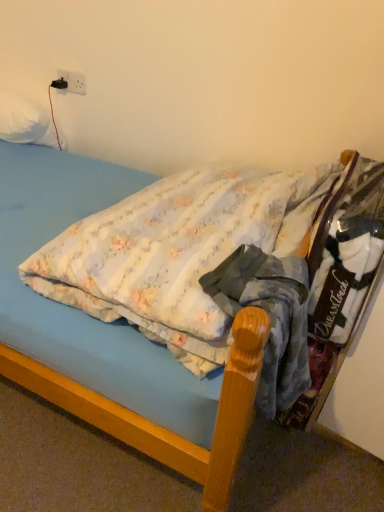
What do you see at coordinates (101, 330) in the screenshot?
I see `fluffy cotton bed at center` at bounding box center [101, 330].

You are a GUI agent. You are given a task and a screenshot of the screen. Output one action in this format:
    pyautogui.click(x=<x>, y=<y>)
    Task: Click on the blue cotton shirt at center
    The height and width of the screenshot is (512, 384).
    Given the screenshot: What is the action you would take?
    [x=270, y=317]

The height and width of the screenshot is (512, 384). I want to click on fluffy cotton bed at center, so [x=101, y=330].

In terms of size, does white soft pillow at upper left appear bigger or smaller than fluffy cotton bed at center?

Clearly, white soft pillow at upper left is smaller in size than fluffy cotton bed at center.

Does white soft pillow at upper left have a lesser height compared to fluffy cotton bed at center?

Indeed, white soft pillow at upper left has a lesser height compared to fluffy cotton bed at center.

Is fluffy cotton bed at center surrounded by white soft pillow at upper left?

No, fluffy cotton bed at center is located outside of white soft pillow at upper left.

Considering the sizes of white soft pillow at upper left and fluffy cotton bed at center in the image, is white soft pillow at upper left wider or thinner than fluffy cotton bed at center?

In the image, white soft pillow at upper left appears to be more narrow than fluffy cotton bed at center.

Which of these two, fluffy cotton bed at center or blue cotton shirt at center, is thinner?

Thinner between the two is blue cotton shirt at center.

Considering the relative positions of fluffy cotton bed at center and blue cotton shirt at center in the image provided, is fluffy cotton bed at center behind blue cotton shirt at center?

No, fluffy cotton bed at center is closer to the viewer.

Looking at this image, who is smaller, fluffy cotton bed at center or blue cotton shirt at center?

blue cotton shirt at center.

Can you see white plastic electric outlet at upper left touching fluffy cotton bed at center?

There is a gap between white plastic electric outlet at upper left and fluffy cotton bed at center.

From the image's perspective, is white plastic electric outlet at upper left positioned above or below fluffy cotton bed at center?

Based on their image positions, white plastic electric outlet at upper left is located above fluffy cotton bed at center.

Does point (84, 77) come in front of point (42, 176)?

No, it is behind (42, 176).

Could fluffy cotton bed at center be considered to be inside white plastic electric outlet at upper left?

No, white plastic electric outlet at upper left does not contain fluffy cotton bed at center.

Which of these two, fluffy cotton bed at center or white soft pillow at upper left, is thinner?

white soft pillow at upper left.

Does point (239, 432) come farther from viewer compared to point (9, 126)?

No.

From the image's perspective, who appears lower, fluffy cotton bed at center or white soft pillow at upper left?

fluffy cotton bed at center, from the image's perspective.

From the image's perspective, which one is positioned higher, white plastic electric outlet at upper left or blue cotton shirt at center?

white plastic electric outlet at upper left.

Which object is further away from the camera taking this photo, white plastic electric outlet at upper left or blue cotton shirt at center?

white plastic electric outlet at upper left.

Can you confirm if white plastic electric outlet at upper left is smaller than blue cotton shirt at center?

Yes, white plastic electric outlet at upper left is smaller than blue cotton shirt at center.

Is point (85, 90) behind point (296, 261)?

Yes, it is.

Is white soft pillow at upper left smaller than blue cotton shirt at center?

Actually, white soft pillow at upper left might be larger than blue cotton shirt at center.

Can you tell me how much white soft pillow at upper left and blue cotton shirt at center differ in facing direction?

The angular difference between white soft pillow at upper left and blue cotton shirt at center is 80.8 degrees.

Considering the relative sizes of white soft pillow at upper left and blue cotton shirt at center in the image provided, is white soft pillow at upper left wider than blue cotton shirt at center?

No.

From a real-world perspective, is white plastic electric outlet at upper left positioned above or below white soft pillow at upper left?

white plastic electric outlet at upper left is situated higher than white soft pillow at upper left in the real world.

Is point (74, 91) positioned before point (32, 133)?

No, it is behind (32, 133).

Is white plastic electric outlet at upper left turned away from white soft pillow at upper left?

No, white plastic electric outlet at upper left is not facing the opposite direction of white soft pillow at upper left.

Between white plastic electric outlet at upper left and white soft pillow at upper left, which one has more height?

white soft pillow at upper left is taller.

Identify the location of bed that is under the white soft pillow at upper left (from a real-world perspective). (101, 330).

Image resolution: width=384 pixels, height=512 pixels. I want to click on bed that appears on the left of blue cotton shirt at center, so click(101, 330).

From the image, which object appears to be nearer to white plastic electric outlet at upper left, fluffy cotton bed at center or blue cotton shirt at center?

Among the two, fluffy cotton bed at center is located nearer to white plastic electric outlet at upper left.

Based on their spatial positions, is fluffy cotton bed at center or white soft pillow at upper left closer to blue cotton shirt at center?

Based on the image, fluffy cotton bed at center appears to be nearer to blue cotton shirt at center.

Looking at this image, estimate the real-world distances between objects in this image. Which object is further from white plastic electric outlet at upper left, white soft pillow at upper left or fluffy cotton bed at center?

Among the two, fluffy cotton bed at center is located further to white plastic electric outlet at upper left.

From the image, which object appears to be nearer to white plastic electric outlet at upper left, fluffy cotton bed at center or white soft pillow at upper left?

white soft pillow at upper left lies closer to white plastic electric outlet at upper left than the other object.

Considering their positions, is blue cotton shirt at center positioned further to white plastic electric outlet at upper left than white soft pillow at upper left?

Based on the image, blue cotton shirt at center appears to be further to white plastic electric outlet at upper left.

Estimate the real-world distances between objects in this image. Which object is closer to fluffy cotton bed at center, blue cotton shirt at center or white soft pillow at upper left?

Among the two, blue cotton shirt at center is located nearer to fluffy cotton bed at center.

Estimate the real-world distances between objects in this image. Which object is further from white soft pillow at upper left, white plastic electric outlet at upper left or fluffy cotton bed at center?

The object further to white soft pillow at upper left is fluffy cotton bed at center.

Which object lies nearer to the anchor point white soft pillow at upper left, fluffy cotton bed at center or blue cotton shirt at center?

fluffy cotton bed at center lies closer to white soft pillow at upper left than the other object.

Where is `pillow between fluffy cotton bed at center and white plastic electric outlet at upper left from front to back`? This screenshot has width=384, height=512. pillow between fluffy cotton bed at center and white plastic electric outlet at upper left from front to back is located at coordinates (27, 122).

I want to click on clothing located between fluffy cotton bed at center and white plastic electric outlet at upper left in the depth direction, so click(x=270, y=317).

This screenshot has width=384, height=512. Find the location of `clothing positioned between fluffy cotton bed at center and white soft pillow at upper left from near to far`. clothing positioned between fluffy cotton bed at center and white soft pillow at upper left from near to far is located at coordinates (270, 317).

The height and width of the screenshot is (512, 384). In order to click on pillow positioned between blue cotton shirt at center and white plastic electric outlet at upper left from near to far in this screenshot , I will do `click(27, 122)`.